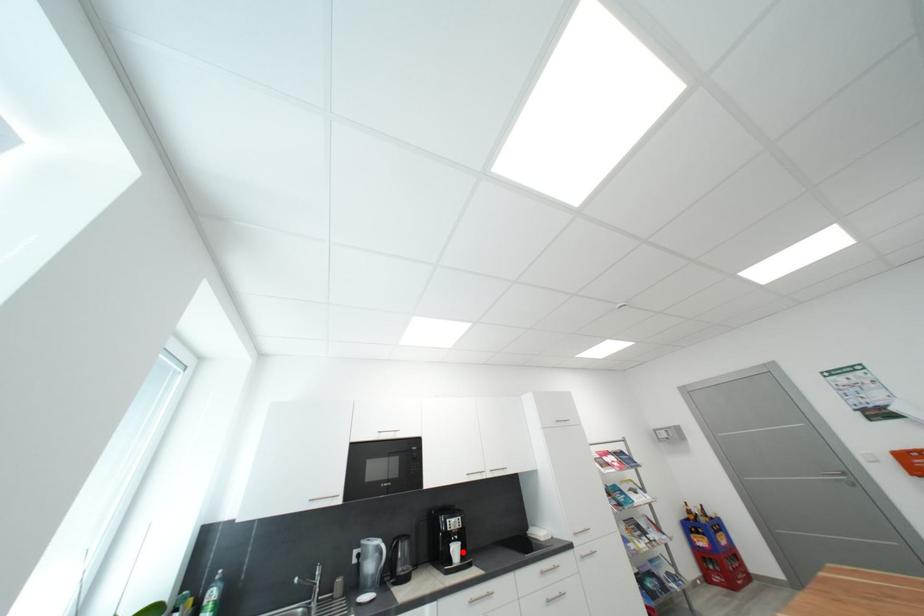
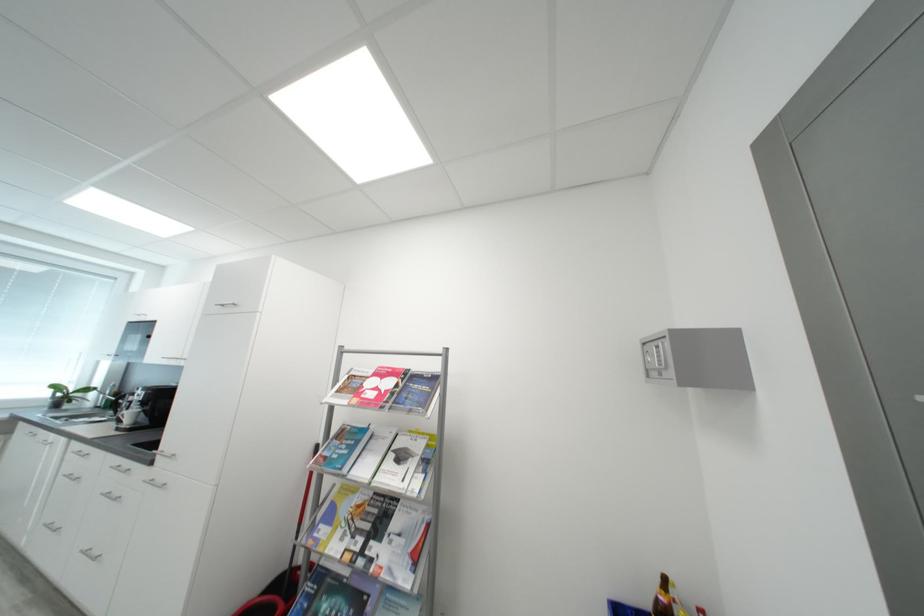
In the second image, find the point that corresponds to the highlighted location in the first image.

(138, 416)